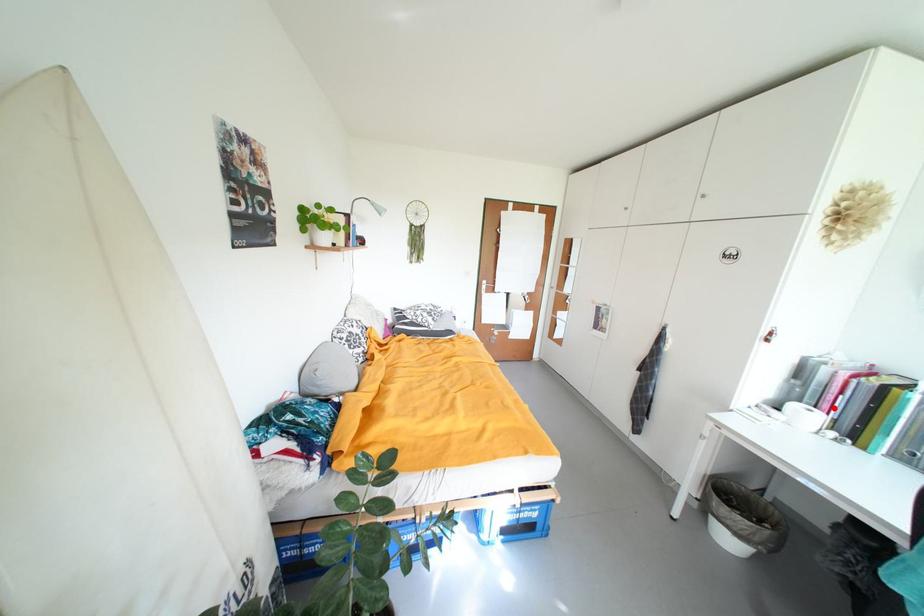
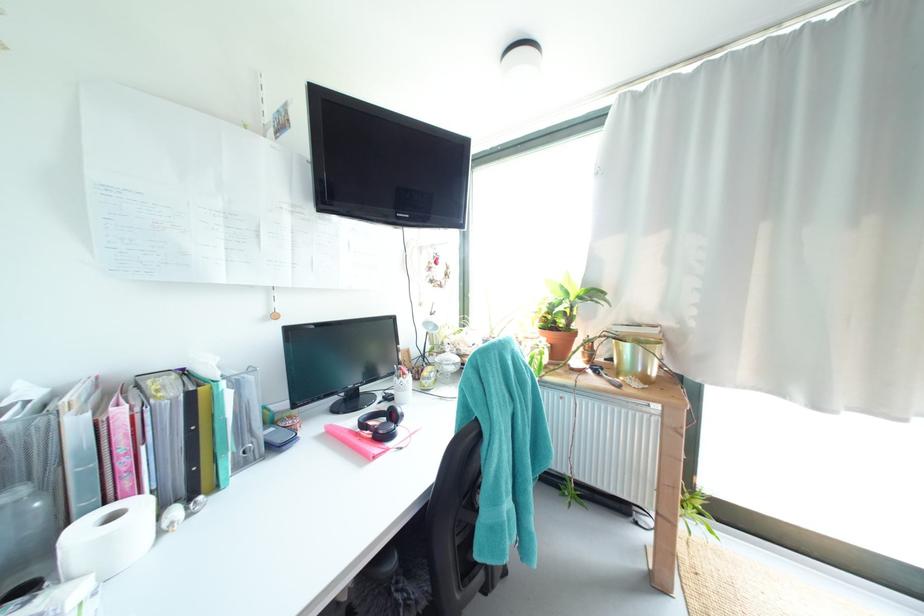
The point at the highlighted location is marked in the first image. Where is the corresponding point in the second image?

(135, 485)